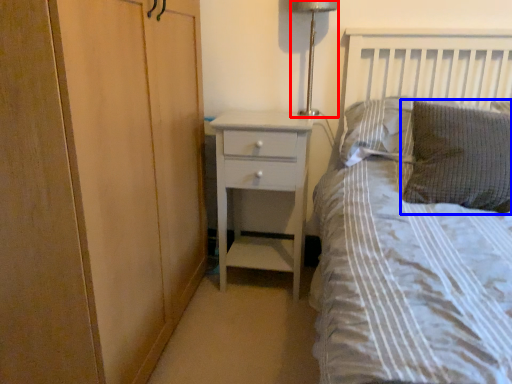
Question: Which object appears farthest to the camera in this image, bedside lamp (highlighted by a red box) or pillow (highlighted by a blue box)?

Choices:
 (A) bedside lamp
 (B) pillow

Answer: (A)